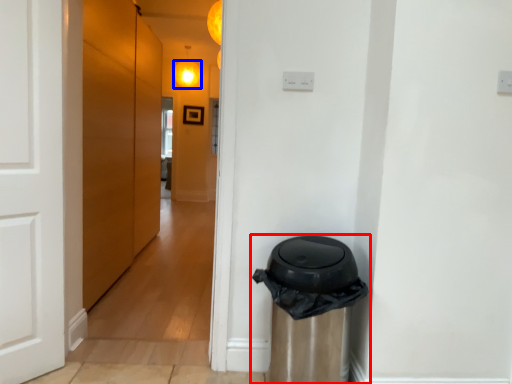
Question: Which point is closer to the camera, waste container (highlighted by a red box) or light (highlighted by a blue box)?

Choices:
 (A) waste container
 (B) light

Answer: (A)